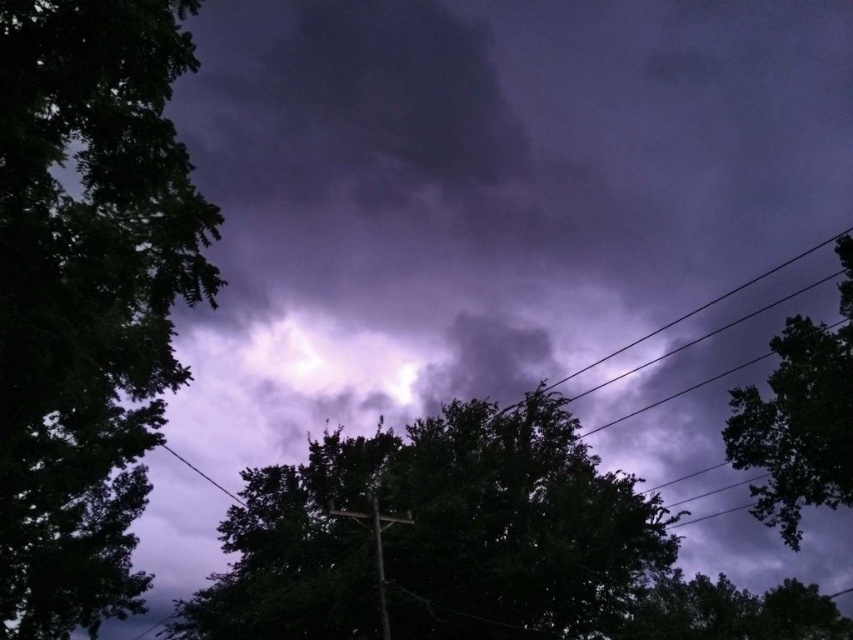
From the picture: Can you confirm if green leafy tree at lower right is positioned to the right of metallic gray telegraph pole at center?

Indeed, green leafy tree at lower right is positioned on the right side of metallic gray telegraph pole at center.

Which of these two, green leafy tree at lower right or metallic gray telegraph pole at center, stands taller?

With more height is green leafy tree at lower right.

The image size is (853, 640). In order to click on green leafy tree at lower right in this screenshot , I will do `click(732, 611)`.

Identify the location of green leafy tree at lower right. (732, 611).

Does point (807, 429) lie behind point (381, 588)?

Yes, it is behind point (381, 588).

Between point (848, 253) and point (375, 500), which one is positioned in front?

Point (375, 500) is in front.

This screenshot has width=853, height=640. Describe the element at coordinates (799, 419) in the screenshot. I see `green leafy tree at right` at that location.

Identify the location of green leafy tree at right. Image resolution: width=853 pixels, height=640 pixels. (799, 419).

Which is more to the left, green leafy tree at left or dark green leafy tree at center?

green leafy tree at left

This screenshot has width=853, height=640. What do you see at coordinates (88, 296) in the screenshot?
I see `green leafy tree at left` at bounding box center [88, 296].

This screenshot has width=853, height=640. I want to click on green leafy tree at left, so click(88, 296).